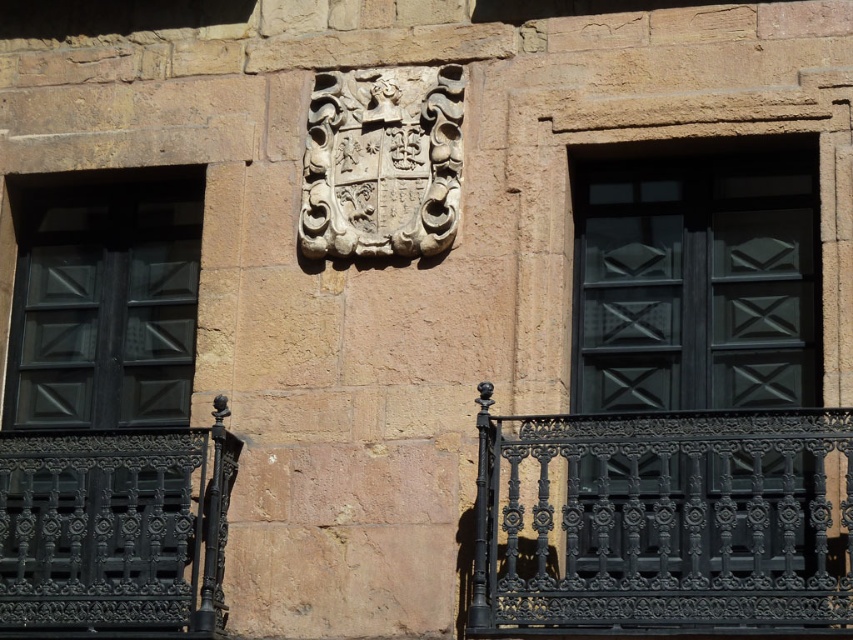
You are an architect examining the building facade. You need to determine which object, the matte black window at right or the matte black wood at left, has a greater width. Based on the scene description, which one is wider?

The matte black wood at left is wider than the matte black window at right because the window is described as thinner than the wood.

You are an architect examining the building facade. You need to install a new security camera that requires a pole 1.2 meters tall. The pole must be placed between the matte black window at right and the white stone coat of arms at center. Given the height difference between these two objects, will the pole fit vertically between them without exceeding their heights?

The matte black window at right is taller than the white stone coat of arms at center. Since the pole is 1.2 meters tall, it can be placed between them as long as the shorter object, the white stone coat of arms at center, is at least 1.2 meters tall. However, without specific height measurements, we can only confirm that the pole will not exceed the height of the taller object, the matte black window at right.

You are an architect inspecting the building facade. You need to install a new security camera that must be placed either on the matte black window at right or the white stone coat of arms at center. Considering their sizes, which object would provide a more stable mounting surface?

The matte black window at right is larger in size than the white stone coat of arms at center, so it would provide a more stable mounting surface for the security camera.